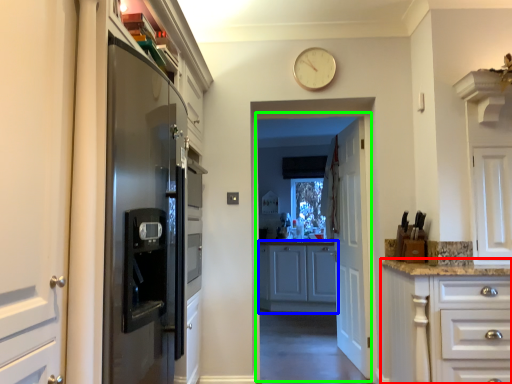
Question: Which object is positioned closest to cabinetry (highlighted by a red box)? Select from cabinetry (highlighted by a blue box) and corridor (highlighted by a green box).

Choices:
 (A) cabinetry
 (B) corridor

Answer: (B)